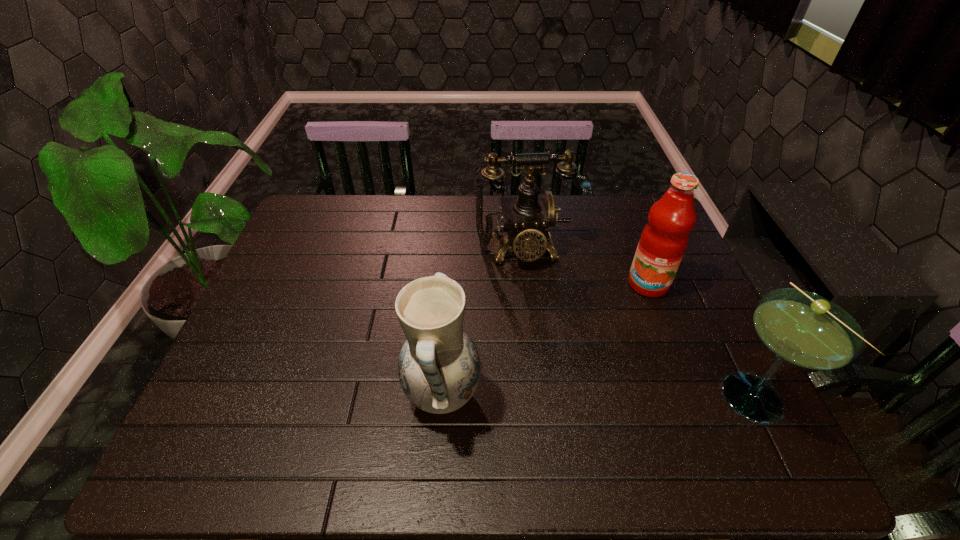
Image resolution: width=960 pixels, height=540 pixels. Find the location of `pottery`. pottery is located at coordinates (439, 367).

The image size is (960, 540). Find the location of `the shortest object`. the shortest object is located at coordinates (801, 328).

The width and height of the screenshot is (960, 540). I want to click on fruit juice, so click(x=663, y=241).

At what (x,y) coordinates should I click in order to perform the action: click on telephone. Please return your answer as a coordinate pair (x, y). Looking at the image, I should click on (526, 218).

At what (x,y) coordinates should I click in order to perform the action: click on vacant space located 0.150m on either side of the pottery. Please return your answer as a coordinate pair (x, y). This screenshot has height=540, width=960. Looking at the image, I should click on (546, 395).

Where is `blank space located on the left of the shortest object`? Image resolution: width=960 pixels, height=540 pixels. blank space located on the left of the shortest object is located at coordinates (596, 395).

Find the location of a particular element. Image resolution: width=960 pixels, height=540 pixels. free region located on the front label of the fruit juice is located at coordinates (638, 332).

The width and height of the screenshot is (960, 540). Find the location of `vacant region located 0.100m on the front label of the fruit juice`. vacant region located 0.100m on the front label of the fruit juice is located at coordinates (639, 324).

At what (x,y) coordinates should I click in order to perform the action: click on vacant space located 0.260m on the front label of the fruit juice. Please return your answer as a coordinate pair (x, y). Looking at the image, I should click on (630, 372).

Where is `free spot located on the rotary dial of the telephone`? The image size is (960, 540). free spot located on the rotary dial of the telephone is located at coordinates (530, 289).